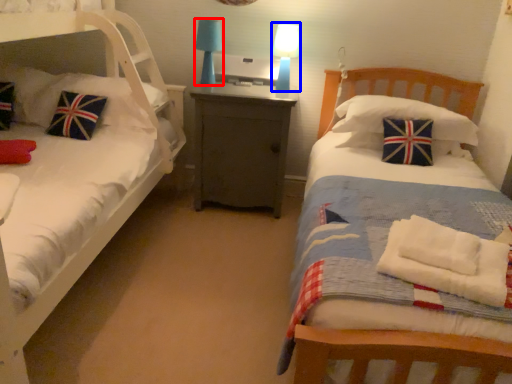
Question: Among these objects, which one is farthest to the camera, table lamp (highlighted by a red box) or table lamp (highlighted by a blue box)?

Choices:
 (A) table lamp
 (B) table lamp

Answer: (A)